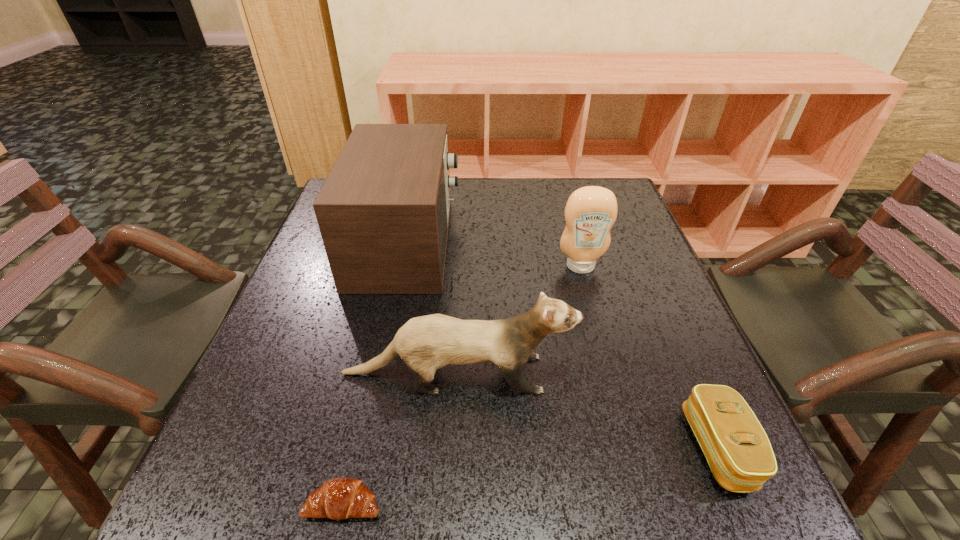
Find the location of a particular element. Image resolution: width=960 pixels, height=540 pixels. object that is positioned at the near right corner is located at coordinates (738, 451).

You are a GUI agent. You are given a task and a screenshot of the screen. Output one action in this format:
    pyautogui.click(x=<x>, y=<y>)
    Task: Click on the free space at the far edge
    
    Given the screenshot: What is the action you would take?
    pyautogui.click(x=488, y=180)

In order to click on free space at the near edge of the desktop in this screenshot , I will do `click(588, 504)`.

Find the location of a particular element. The image size is (960, 540). vacant space at the right edge is located at coordinates (647, 330).

You are a GUI agent. You are given a task and a screenshot of the screen. Output one action in this format:
    pyautogui.click(x=<x>, y=<y>)
    Task: Click on the free space at the far right corner of the desktop
    The image size is (960, 540).
    Given the screenshot: What is the action you would take?
    pyautogui.click(x=616, y=191)

The height and width of the screenshot is (540, 960). What are the coordinates of `free area in between the crescent roll and the ferret` in the screenshot? It's located at (400, 438).

Image resolution: width=960 pixels, height=540 pixels. Identify the location of vacant area that lies between the shortest object and the rightmost object. (531, 476).

You are a GUI agent. You are given a task and a screenshot of the screen. Output one action in this format:
    pyautogui.click(x=<x>, y=<y>)
    Task: Click on the blank region between the crescent roll and the ferret
    The height and width of the screenshot is (540, 960).
    Given the screenshot: What is the action you would take?
    pyautogui.click(x=400, y=438)

Identify the location of vacant point located between the radio receiver and the shortest object. (375, 373).

Identify the location of unoccupied position between the radio receiver and the second shortest object. Image resolution: width=960 pixels, height=540 pixels. (563, 346).